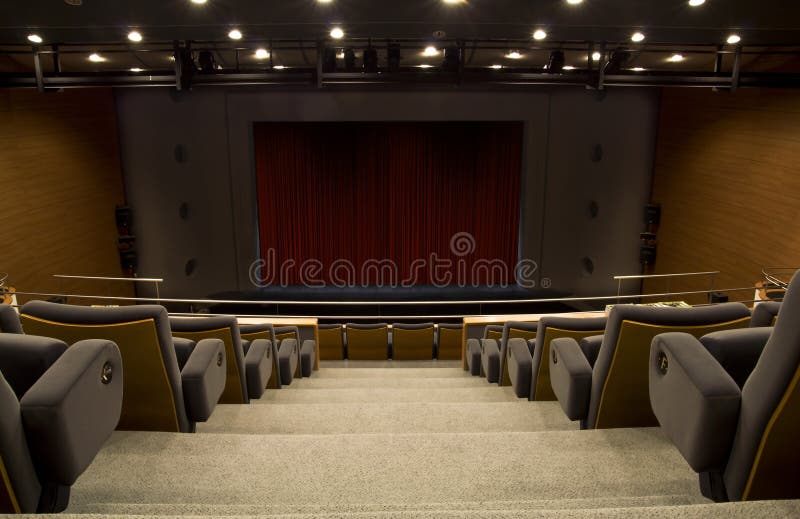
This screenshot has width=800, height=519. I want to click on rows of seats, so click(x=60, y=427), click(x=169, y=371), click(x=253, y=363), click(x=285, y=356), click(x=309, y=354), click(x=362, y=341).